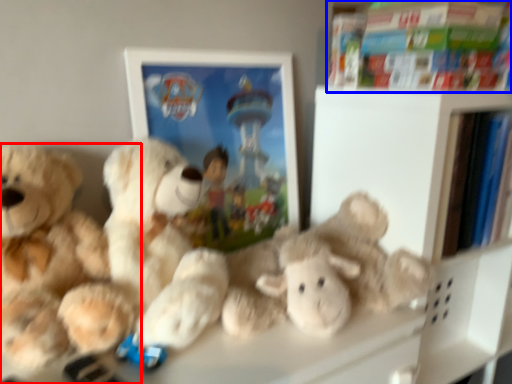
Question: Which object appears closest to the camera in this image, teddy bear (highlighted by a red box) or book (highlighted by a blue box)?

Choices:
 (A) teddy bear
 (B) book

Answer: (A)